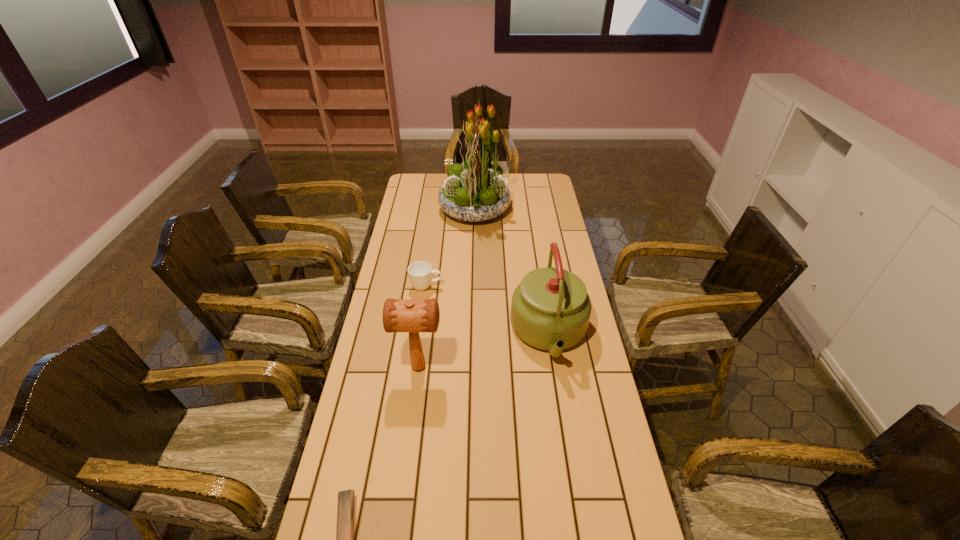
Find the location of `empty location between the kettle and the cup`. empty location between the kettle and the cup is located at coordinates (488, 310).

Where is `free space that is in between the tallest object and the kettle`? Image resolution: width=960 pixels, height=540 pixels. free space that is in between the tallest object and the kettle is located at coordinates (512, 272).

Find the location of `vacant space that is in between the cup and the kettle`. vacant space that is in between the cup and the kettle is located at coordinates (488, 310).

This screenshot has width=960, height=540. I want to click on object that stands as the closest to the tallest object, so click(x=420, y=272).

Select which object appears as the third closest to the kettle. Please provide its 2D coordinates. Your answer should be formatted as a tuple, i.e. [(x, y)], where the tuple contains the x and y coordinates of a point satisfying the conditions above.

[(475, 191)]

I want to click on vacant space that satisfies the following two spatial constraints: 1. at the spout of the kettle; 2. on the strike surface of the farther mallet, so click(x=555, y=367).